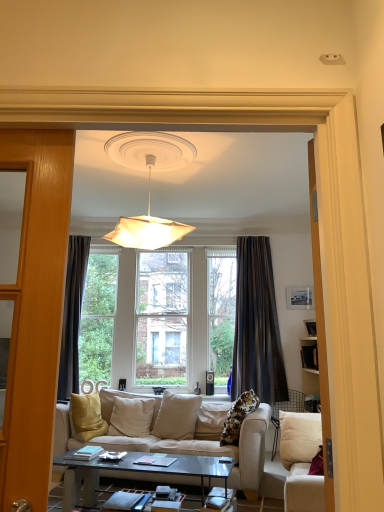
Question: From a real-world perspective, is beige fabric couch at center, which is the 1th studio couch in back-to-front order, located beneath matte black picture frame at upper right?

Choices:
 (A) no
 (B) yes

Answer: (B)

Question: Is beige fabric couch at center, which is the 1th studio couch in back-to-front order, further to camera compared to matte black picture frame at upper right?

Choices:
 (A) no
 (B) yes

Answer: (A)

Question: Is the depth of beige fabric couch at center, placed as the 2th studio couch when sorted from front to back, less than that of matte black picture frame at upper right?

Choices:
 (A) yes
 (B) no

Answer: (A)

Question: Considering the relative sizes of beige fabric couch at center, placed as the 2th studio couch when sorted from front to back, and matte black picture frame at upper right in the image provided, is beige fabric couch at center, placed as the 2th studio couch when sorted from front to back, bigger than matte black picture frame at upper right?

Choices:
 (A) yes
 (B) no

Answer: (A)

Question: From a real-world perspective, is beige fabric couch at center, which is the 1th studio couch in back-to-front order, over matte black picture frame at upper right?

Choices:
 (A) yes
 (B) no

Answer: (B)

Question: From a real-world perspective, is beige fabric couch at center, placed as the 2th studio couch when sorted from front to back, positioned above or below dark gray textured curtain at center?

Choices:
 (A) above
 (B) below

Answer: (B)

Question: Looking at the image, does beige fabric couch at center, which is the 1th studio couch in back-to-front order, seem bigger or smaller compared to dark gray textured curtain at center?

Choices:
 (A) small
 (B) big

Answer: (B)

Question: Considering the positions of beige fabric couch at center, placed as the 2th studio couch when sorted from front to back, and dark gray textured curtain at center in the image, is beige fabric couch at center, placed as the 2th studio couch when sorted from front to back, taller or shorter than dark gray textured curtain at center?

Choices:
 (A) tall
 (B) short

Answer: (B)

Question: Visually, is beige fabric couch at center, which is the 1th studio couch in back-to-front order, positioned to the left or to the right of dark gray textured curtain at center?

Choices:
 (A) right
 (B) left

Answer: (B)

Question: Considering the positions of matte black picture frame at upper right and glassy black coffee table at center in the image, is matte black picture frame at upper right bigger or smaller than glassy black coffee table at center?

Choices:
 (A) big
 (B) small

Answer: (B)

Question: Considering the positions of matte black picture frame at upper right and glassy black coffee table at center in the image, is matte black picture frame at upper right wider or thinner than glassy black coffee table at center?

Choices:
 (A) wide
 (B) thin

Answer: (B)

Question: From a real-world perspective, is matte black picture frame at upper right physically located above or below glassy black coffee table at center?

Choices:
 (A) above
 (B) below

Answer: (A)

Question: Is matte black picture frame at upper right spatially inside glassy black coffee table at center, or outside of it?

Choices:
 (A) outside
 (B) inside

Answer: (A)

Question: Considering the positions of beige fabric couch at center, placed as the 2th studio couch when sorted from front to back, and white paper lampshade at upper center in the image, is beige fabric couch at center, placed as the 2th studio couch when sorted from front to back, bigger or smaller than white paper lampshade at upper center?

Choices:
 (A) small
 (B) big

Answer: (B)

Question: Is beige fabric couch at center, placed as the 2th studio couch when sorted from front to back, inside or outside of white paper lampshade at upper center?

Choices:
 (A) outside
 (B) inside

Answer: (A)